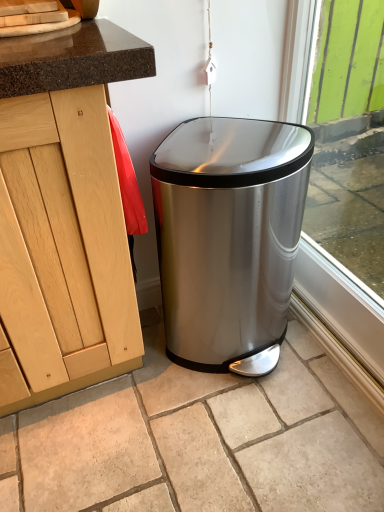
Question: Is stainless steel trash can at center inside or outside of green painted wood at right?

Choices:
 (A) inside
 (B) outside

Answer: (B)

Question: From their relative heights in the image, would you say stainless steel trash can at center is taller or shorter than green painted wood at right?

Choices:
 (A) tall
 (B) short

Answer: (B)

Question: Looking at the image, does stainless steel trash can at center seem bigger or smaller compared to green painted wood at right?

Choices:
 (A) small
 (B) big

Answer: (B)

Question: Does point (317, 14) appear closer or farther from the camera than point (200, 230)?

Choices:
 (A) farther
 (B) closer

Answer: (A)

Question: Looking at their shapes, would you say green painted wood at right is wider or thinner than stainless steel trash can at center?

Choices:
 (A) thin
 (B) wide

Answer: (A)

Question: In terms of size, does green painted wood at right appear bigger or smaller than stainless steel trash can at center?

Choices:
 (A) small
 (B) big

Answer: (A)

Question: From their relative heights in the image, would you say green painted wood at right is taller or shorter than stainless steel trash can at center?

Choices:
 (A) tall
 (B) short

Answer: (A)